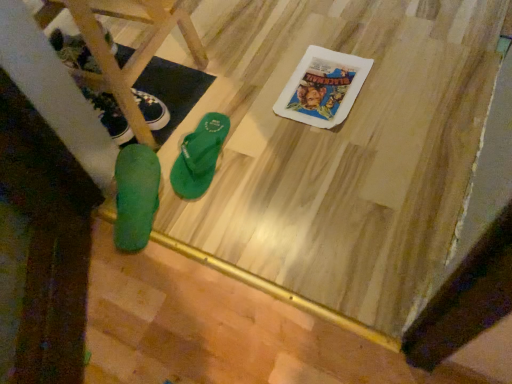
Locate an element on the screen. The image size is (512, 384). vacant area that is situated to the right of matte black sneaker at left, the 1th footwear when ordered from left to right is located at coordinates (187, 91).